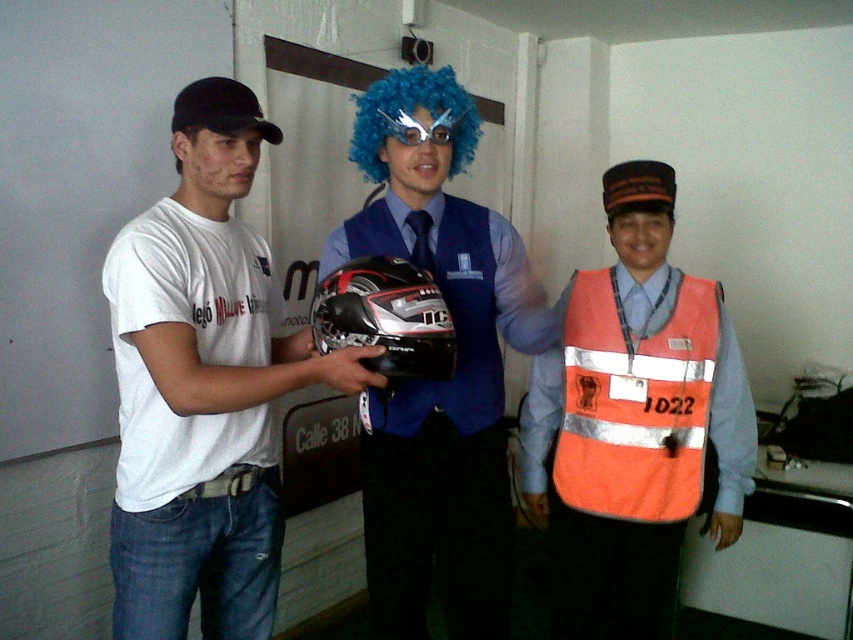
You are organizing a costume party and need to arrange the orange reflective vest at center and the shiny black helmet at center in a line from left to right. Based on their positions in the image, which should come first?

The shiny black helmet at center should come first since the orange reflective vest at center is positioned on the right side of it.

You are standing at the origin point of the coordinate system. You need to move towards the orange reflective vest at center. What direction should you move in?

The orange reflective vest at center is located at coordinate point 0.659 on the x axis and 0.743 on the y axis. Since you are at the origin point, you should move towards the positive x and positive y direction to reach the orange reflective vest at center.